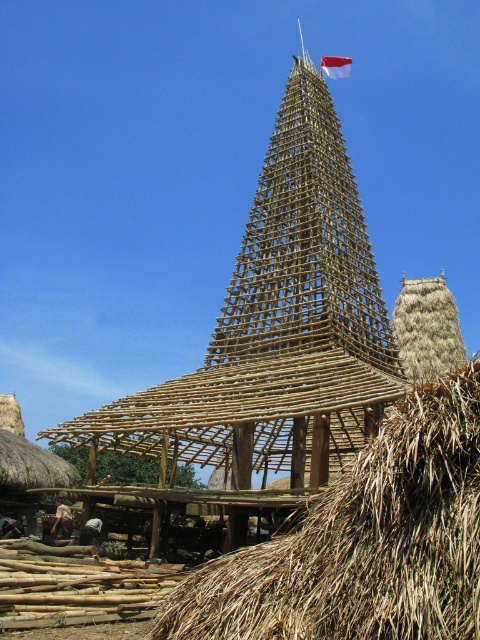
Based on the photo, you are a visitor standing at the base of the bamboo structure. You want to place a small offering on the brown thatch at center without getting hit by the red fabric flag at upper center. Is the flag above the thatch?

The brown thatch at center is positioned under the red fabric flag at upper center, so yes, the flag is above the thatch. Place the offering carefully to avoid the flag.

You are a visitor standing at the base of the bamboo structure. You see the brown thatch at center and the red fabric flag at upper center. Which object is closer to you?

The brown thatch at center is closer to you since it is in front of the red fabric flag at upper center.

You are a drone operator trying to capture aerial footage of the brown thatch at center and the red fabric flag at upper center. Your drone has a maximum range of 120 meters. Can the drone safely travel between the two objects without exceeding its range?

The distance between the brown thatch at center and the red fabric flag at upper center is 119.93 meters, which is within the drone operator drone has a maximum range of 120 meters. The drone can safely travel between the two objects without exceeding its range.